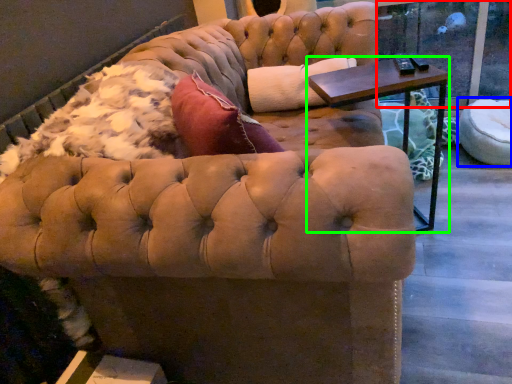
Question: Estimate the real-world distances between objects in this image. Which object is farther from window screen (highlighted by a red box), swivel chair (highlighted by a blue box) or table (highlighted by a green box)?

Choices:
 (A) swivel chair
 (B) table

Answer: (B)